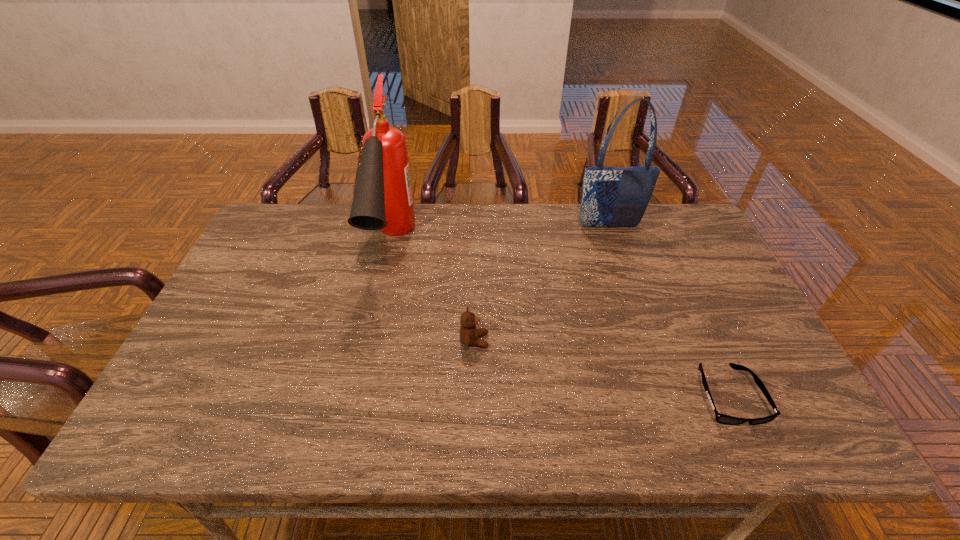
Locate an element on the screen. Image resolution: width=960 pixels, height=540 pixels. vacant region at the near right corner of the desktop is located at coordinates (789, 442).

Where is `vacant space in between the shopping bag and the second object from left to right`? This screenshot has height=540, width=960. vacant space in between the shopping bag and the second object from left to right is located at coordinates (541, 284).

I want to click on vacant space that's between the leftmost object and the shopping bag, so click(500, 237).

The height and width of the screenshot is (540, 960). Identify the location of free space between the nearest object and the shopping bag. (668, 310).

Where is `free space between the leftmost object and the sunglasses`? This screenshot has height=540, width=960. free space between the leftmost object and the sunglasses is located at coordinates (560, 321).

Locate an element on the screen. vacant area that lies between the shopping bag and the third farthest object is located at coordinates (541, 284).

The image size is (960, 540). I want to click on free space between the shopping bag and the sunglasses, so point(668,310).

At what (x,y) coordinates should I click in order to perform the action: click on empty location between the shopping bag and the nearest object. Please return your answer as a coordinate pair (x, y). The image size is (960, 540). Looking at the image, I should click on (668, 310).

Where is `vacant point located between the teddy bear and the shopping bag`? The height and width of the screenshot is (540, 960). vacant point located between the teddy bear and the shopping bag is located at coordinates (541, 284).

This screenshot has width=960, height=540. I want to click on free space between the nearest object and the leftmost object, so click(x=560, y=321).